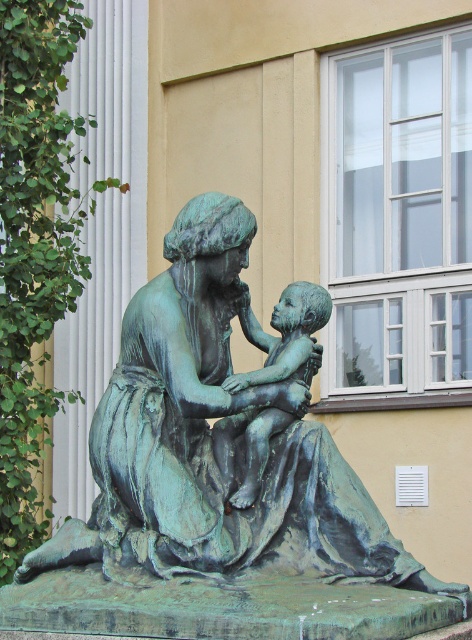
Between green patina bronze statue at center and bronze statue of child at center, which one appears on the right side from the viewer's perspective?

bronze statue of child at center

Between green patina bronze statue at center and bronze statue of child at center, which one is positioned higher?

Positioned higher is bronze statue of child at center.

Describe the element at coordinates (218, 442) in the screenshot. I see `green patina bronze statue at center` at that location.

You are a GUI agent. You are given a task and a screenshot of the screen. Output one action in this format:
    pyautogui.click(x=<x>, y=<y>)
    Task: Click on the green patina bronze statue at center
    The height and width of the screenshot is (640, 472).
    Given the screenshot: What is the action you would take?
    pyautogui.click(x=218, y=442)